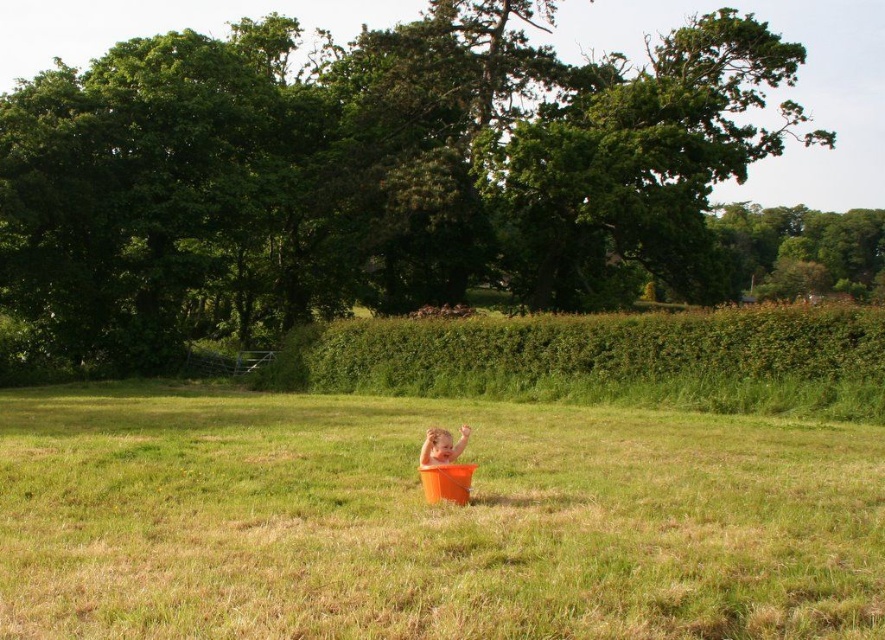
Question: Which point is farther to the camera?

Choices:
 (A) (435, 436)
 (B) (837, 381)
 (C) (708, 460)

Answer: (B)

Question: Which object is positioned farthest from the smooth orange bucket at center?

Choices:
 (A) green leafy hedge at center
 (B) orange matte bucket at center

Answer: (A)

Question: In this image, where is orange matte bucket at center located relative to green leafy hedge at center?

Choices:
 (A) right
 (B) left

Answer: (B)

Question: Is green leafy hedge at center to the right of smooth orange bucket at center from the viewer's perspective?

Choices:
 (A) no
 (B) yes

Answer: (B)

Question: Which point appears farthest from the camera in this image?

Choices:
 (A) (748, 380)
 (B) (296, 461)

Answer: (A)

Question: Does orange matte bucket at center appear on the left side of green leafy hedge at center?

Choices:
 (A) yes
 (B) no

Answer: (A)